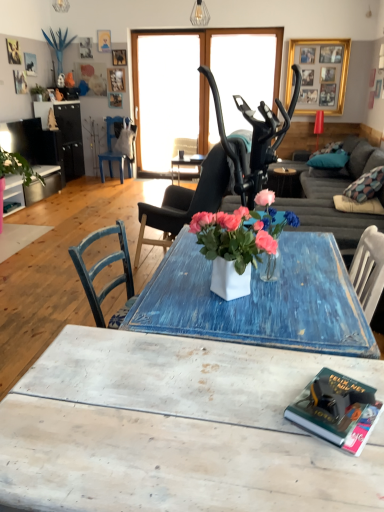
Image resolution: width=384 pixels, height=512 pixels. Identify the location of hardcover book at lower right. (337, 410).

Image resolution: width=384 pixels, height=512 pixels. What do you see at coordinates (166, 97) in the screenshot?
I see `transparent glass door at center` at bounding box center [166, 97].

Locate an element on the screen. The width and height of the screenshot is (384, 512). transparent glass door at center is located at coordinates pos(166,97).

What do you see at coordinates (328, 194) in the screenshot?
I see `velvet grey couch at center` at bounding box center [328, 194].

What is the approximate height of blue painted wood chair at left, which ranks as the 1th chair in back-to-front order?

3.28 feet.

What do you see at coordinates (286, 179) in the screenshot?
I see `blue distressed table at center` at bounding box center [286, 179].

You are a GUI agent. You are given a task and a screenshot of the screen. Output one action in this format:
    pyautogui.click(x=<x>, y=<y>)
    Task: Click on the gold-framed collage at upper center
    
    Given the screenshot: What is the action you would take?
    pyautogui.click(x=318, y=74)

Identify the location of matte black chair at center, which appears as the first chair when viewed from the right. (186, 201).

From the image's perspective, which one is positioned lower, velvet grey couch at center or matte black chair at center, which is the second chair from back to front?

velvet grey couch at center.

From a real-world perspective, relative to matte black chair at center, the first chair viewed from the front, is velvet grey couch at center vertically above or below?

In terms of real-world spatial position, velvet grey couch at center is below matte black chair at center, the first chair viewed from the front.

Where is `studio couch below the matte black chair at center, which is the second chair from back to front (from the image's perspective)`? studio couch below the matte black chair at center, which is the second chair from back to front (from the image's perspective) is located at coordinates (328, 194).

Are velvet grey couch at center and matte black chair at center, the first chair viewed from the front, located far from each other?

velvet grey couch at center is far away from matte black chair at center, the first chair viewed from the front.

Is transparent glass door at center facing away from matte black chair at center, which is the second chair from back to front?

transparent glass door at center is not turned away from matte black chair at center, which is the second chair from back to front.

From the image's perspective, is transparent glass door at center over matte black chair at center, which appears as the first chair when viewed from the right?

Correct, transparent glass door at center appears higher than matte black chair at center, which appears as the first chair when viewed from the right, in the image.

From a real-world perspective, is transparent glass door at center over matte black chair at center, which is the 1th chair from bottom to top?

Correct, in the physical world, transparent glass door at center is higher than matte black chair at center, which is the 1th chair from bottom to top.

Image resolution: width=384 pixels, height=512 pixels. Identify the location of window screen located above the matte black chair at center, which is the 1th chair from bottom to top (from the image's perspective). (166, 97).

In the scene shown: From a real-world perspective, is blue fabric pillow at right positioned above or below matte black chair at center, the first chair viewed from the front?

blue fabric pillow at right is above matte black chair at center, the first chair viewed from the front.

Can you see blue fabric pillow at right touching matte black chair at center, which is the 1th chair from bottom to top?

blue fabric pillow at right and matte black chair at center, which is the 1th chair from bottom to top, are not in contact.

Which object is further away from the camera taking this photo, blue fabric pillow at right or matte black chair at center, which is the second chair from back to front?

blue fabric pillow at right is more distant.

Can you confirm if blue fabric pillow at right is taller than matte black chair at center, which appears as the first chair when viewed from the right?

No, blue fabric pillow at right is not taller than matte black chair at center, which appears as the first chair when viewed from the right.

Looking at this image, considering the positions of objects hardcover book at lower right and transparent glass door at center in the image provided, who is more to the right, hardcover book at lower right or transparent glass door at center?

hardcover book at lower right.

Does hardcover book at lower right turn towards transparent glass door at center?

No, hardcover book at lower right does not turn towards transparent glass door at center.

Considering their positions, is hardcover book at lower right located in front of or behind transparent glass door at center?

hardcover book at lower right is in front of transparent glass door at center.

From the image's perspective, is hardcover book at lower right above or below transparent glass door at center?

Based on their image positions, hardcover book at lower right is located beneath transparent glass door at center.

Considering the relative sizes of blue painted wood chair at left, which ranks as the 1th chair in back-to-front order, and white distressed wood coffee table at lower center in the image provided, is blue painted wood chair at left, which ranks as the 1th chair in back-to-front order, wider than white distressed wood coffee table at lower center?

No, blue painted wood chair at left, which ranks as the 1th chair in back-to-front order, is not wider than white distressed wood coffee table at lower center.

Which point is more distant from viewer, [112,170] or [56,501]?

The point [112,170] is farther.

Who is smaller, blue painted wood chair at left, the 1th chair viewed from the top, or white distressed wood coffee table at lower center?

blue painted wood chair at left, the 1th chair viewed from the top.

Who is more distant, blue painted wood chair at left, positioned as the second chair in right-to-left order, or white distressed wood coffee table at lower center?

Positioned behind is blue painted wood chair at left, positioned as the second chair in right-to-left order.

Considering the relative sizes of blue fabric pillow at right and blue painted wood chair at left, positioned as the second chair in right-to-left order, in the image provided, is blue fabric pillow at right taller than blue painted wood chair at left, positioned as the second chair in right-to-left order,?

No, blue fabric pillow at right is not taller than blue painted wood chair at left, positioned as the second chair in right-to-left order.

From the image's perspective, is blue fabric pillow at right located beneath blue painted wood chair at left, placed as the 1th chair when sorted from left to right?

Indeed, from the image's perspective, blue fabric pillow at right is shown beneath blue painted wood chair at left, placed as the 1th chair when sorted from left to right.

Who is more distant, velvet grey couch at center or hardcover book at lower right?

velvet grey couch at center is further away from the camera.

From the image's perspective, which one is positioned higher, velvet grey couch at center or hardcover book at lower right?

From the image's view, velvet grey couch at center is above.

Can you confirm if velvet grey couch at center is shorter than hardcover book at lower right?

Incorrect, the height of velvet grey couch at center does not fall short of that of hardcover book at lower right.

Which of these two, velvet grey couch at center or hardcover book at lower right, is smaller?

With smaller size is hardcover book at lower right.

Where is `chair that is the 1st one when counting backward from the velvet grey couch at center`? Image resolution: width=384 pixels, height=512 pixels. chair that is the 1st one when counting backward from the velvet grey couch at center is located at coordinates (186, 201).

From the transparent glass door at center, count 2nd chairs forward and point to it. Please provide its 2D coordinates.

[(186, 201)]

When comparing their distances from blue distressed table at center, does hardcover book at lower right or velvet grey couch at center seem further?

hardcover book at lower right lies further to blue distressed table at center than the other object.

From the picture: When comparing their distances from transparent glass door at center, does matte black chair at center, which appears as the first chair when viewed from the right, or hardcover book at lower right seem closer?

matte black chair at center, which appears as the first chair when viewed from the right.

From the image, which object appears to be nearer to hardcover book at lower right, blue fabric pillow at right or matte black chair at center, marked as the second chair in a left-to-right arrangement?

matte black chair at center, marked as the second chair in a left-to-right arrangement.

Estimate the real-world distances between objects in this image. Which object is further from gold-framed collage at upper center, transparent glass door at center or velvet grey couch at center?

Based on the image, transparent glass door at center appears to be further to gold-framed collage at upper center.

Looking at the image, which one is located further to velvet grey couch at center, matte black chair at center, which appears as the first chair when viewed from the right, or white distressed wood coffee table at lower center?

Among the two, white distressed wood coffee table at lower center is located further to velvet grey couch at center.

Based on their spatial positions, is gold-framed collage at upper center or blue distressed table at center closer to blue fabric pillow at right?

blue distressed table at center.

Looking at the image, which one is located further to blue distressed table at center, matte black chair at center, the 2th chair viewed from the top, or blue fabric pillow at right?

Based on the image, matte black chair at center, the 2th chair viewed from the top, appears to be further to blue distressed table at center.

Based on their spatial positions, is gold-framed collage at upper center or blue distressed table at center closer to velvet grey couch at center?

blue distressed table at center is closer to velvet grey couch at center.

Where is `chair between white distressed wood coffee table at lower center and blue fabric pillow at right from front to back`? The image size is (384, 512). chair between white distressed wood coffee table at lower center and blue fabric pillow at right from front to back is located at coordinates (186, 201).

What are the coordinates of `window screen between blue painted wood chair at left, the 1th chair viewed from the top, and blue distressed table at center` in the screenshot? It's located at (166, 97).

What are the coordinates of `pillow located between hardcover book at lower right and blue distressed table at center in the depth direction` in the screenshot? It's located at (329, 160).

Locate an element on the screen. studio couch positioned between hardcover book at lower right and matte black chair at center, which appears as the first chair when viewed from the right, from near to far is located at coordinates (328, 194).